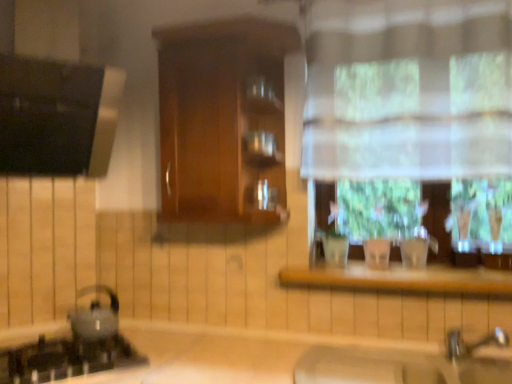
The width and height of the screenshot is (512, 384). Identify the location of wooden at center. (401, 279).

The height and width of the screenshot is (384, 512). I want to click on shiny metallic kettle at lower left, so click(95, 316).

You are a GUI agent. You are given a task and a screenshot of the screen. Output one action in this format:
    pyautogui.click(x=<x>, y=<y>)
    Task: Click on the wooden at center
    
    Given the screenshot: What is the action you would take?
    pyautogui.click(x=401, y=279)

Locate an element on the screen. The image size is (512, 384). cabinetry above the black glass gas stove at lower left (from a real-world perspective) is located at coordinates 222,117.

Is wooden cabinet at center wider than black glass gas stove at lower left?

In fact, wooden cabinet at center might be narrower than black glass gas stove at lower left.

Is wooden cabinet at center oriented towards black glass gas stove at lower left?

No, wooden cabinet at center is not facing towards black glass gas stove at lower left.

Who is bigger, wooden cabinet at center or black glass gas stove at lower left?

wooden cabinet at center.

Based on the photo, considering the relative positions of wooden at center and black glass gas stove at lower left in the image provided, is wooden at center to the left of black glass gas stove at lower left from the viewer's perspective?

No.

In terms of height, does wooden at center look taller or shorter compared to black glass gas stove at lower left?

wooden at center is shorter than black glass gas stove at lower left.

From a real-world perspective, is wooden at center physically located above or below black glass gas stove at lower left?

Clearly, from a real-world perspective, wooden at center is above black glass gas stove at lower left.

From the image's perspective, is wooden at center above beige matte sink at lower center?

Indeed, from the image's perspective, wooden at center is shown above beige matte sink at lower center.

From a real-world perspective, which object rests below the other?

beige matte sink at lower center.

Where is `window sill that appears above the beige matte sink at lower center (from the image's perspective)`? window sill that appears above the beige matte sink at lower center (from the image's perspective) is located at coordinates (401, 279).

How much distance is there between shiny metallic kettle at lower left and wooden cabinet at center?

36.74 inches.

Consider the image. Are shiny metallic kettle at lower left and wooden cabinet at center far apart?

shiny metallic kettle at lower left is actually quite close to wooden cabinet at center.

From a real-world perspective, is shiny metallic kettle at lower left positioned above or below wooden cabinet at center?

shiny metallic kettle at lower left is below wooden cabinet at center.

Considering the positions of point (100, 290) and point (168, 48), is point (100, 290) closer or farther from the camera than point (168, 48)?

Point (100, 290).

Based on the photo, considering the relative positions of shiny metallic kettle at lower left and black glass gas stove at lower left in the image provided, is shiny metallic kettle at lower left to the left or to the right of black glass gas stove at lower left?

In the image, shiny metallic kettle at lower left appears on the right side of black glass gas stove at lower left.

Is shiny metallic kettle at lower left wider or thinner than black glass gas stove at lower left?

shiny metallic kettle at lower left is thinner than black glass gas stove at lower left.

Considering the sizes of shiny metallic kettle at lower left and black glass gas stove at lower left in the image, is shiny metallic kettle at lower left bigger or smaller than black glass gas stove at lower left?

In the image, shiny metallic kettle at lower left appears to be smaller than black glass gas stove at lower left.

In the image, there is a black glass gas stove at lower left. In order to click on appliance above it (from the image's perspective) in this screenshot , I will do [95, 316].

Identify the location of cabinetry above the wooden at center (from a real-world perspective). The image size is (512, 384). 222,117.

Is wooden cabinet at center to the left of wooden at center from the viewer's perspective?

Yes, wooden cabinet at center is to the left of wooden at center.

Would you say wooden at center is a long distance from shiny metallic kettle at lower left?

Absolutely, wooden at center is distant from shiny metallic kettle at lower left.

From a real-world perspective, is wooden at center beneath shiny metallic kettle at lower left?

No, from a real-world perspective, wooden at center is not beneath shiny metallic kettle at lower left.

Identify the location of cabinetry above the black glass gas stove at lower left (from a real-world perspective). (222, 117).

At what (x,y) coordinates should I click in order to perform the action: click on window sill behind the black glass gas stove at lower left. Please return your answer as a coordinate pair (x, y). Looking at the image, I should click on (401, 279).

From the picture: Which object lies further to the anchor point white sheer curtain at upper right, wooden at center or wooden cabinet at center?

wooden at center lies further to white sheer curtain at upper right than the other object.

When comparing their distances from wooden cabinet at center, does white sheer curtain at upper right or black glass gas stove at lower left seem further?

Based on the image, black glass gas stove at lower left appears to be further to wooden cabinet at center.

Consider the image. From the image, which object appears to be nearer to wooden at center, wooden cabinet at center or black glass gas stove at lower left?

wooden cabinet at center is closer to wooden at center.

Estimate the real-world distances between objects in this image. Which object is further from wooden at center, beige matte sink at lower center or white sheer curtain at upper right?

white sheer curtain at upper right lies further to wooden at center than the other object.

Looking at the image, which one is located closer to wooden at center, white sheer curtain at upper right or beige matte sink at lower center?

beige matte sink at lower center lies closer to wooden at center than the other object.

Looking at the image, which one is located further to wooden at center, black glass gas stove at lower left or wooden cabinet at center?

black glass gas stove at lower left lies further to wooden at center than the other object.

In the scene shown: Based on their spatial positions, is wooden cabinet at center or black glass gas stove at lower left closer to shiny metallic kettle at lower left?

black glass gas stove at lower left lies closer to shiny metallic kettle at lower left than the other object.

Considering their positions, is wooden at center positioned closer to beige matte sink at lower center than white sheer curtain at upper right?

Based on the image, wooden at center appears to be nearer to beige matte sink at lower center.

This screenshot has width=512, height=384. I want to click on cabinetry located between shiny metallic kettle at lower left and white sheer curtain at upper right in the left-right direction, so click(222, 117).

The height and width of the screenshot is (384, 512). What are the coordinates of `curtain between shiny metallic kettle at lower left and wooden at center from left to right` in the screenshot? It's located at (407, 89).

Find the location of `sink situated between black glass gas stove at lower left and white sheer curtain at upper right from left to right`. sink situated between black glass gas stove at lower left and white sheer curtain at upper right from left to right is located at coordinates (406, 364).

The height and width of the screenshot is (384, 512). Find the location of `appliance between wooden cabinet at center and black glass gas stove at lower left vertically`. appliance between wooden cabinet at center and black glass gas stove at lower left vertically is located at coordinates (95, 316).